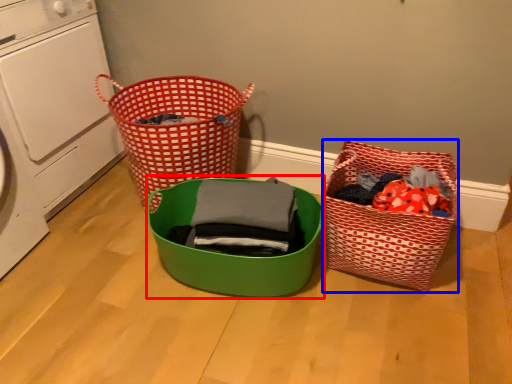
Question: Which object is closer to the camera taking this photo, basket (highlighted by a red box) or basket (highlighted by a blue box)?

Choices:
 (A) basket
 (B) basket

Answer: (A)